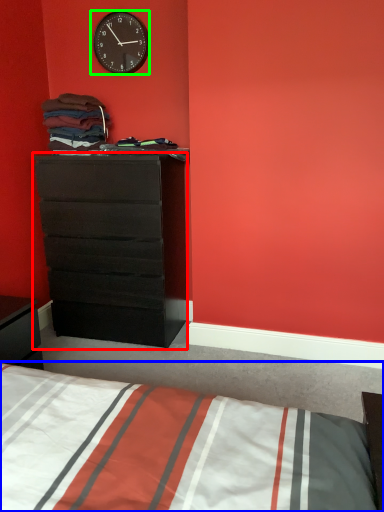
Question: Which is farther away from chest of drawers (highlighted by a red box)? bed (highlighted by a blue box) or wall clock (highlighted by a green box)?

Choices:
 (A) bed
 (B) wall clock

Answer: (A)